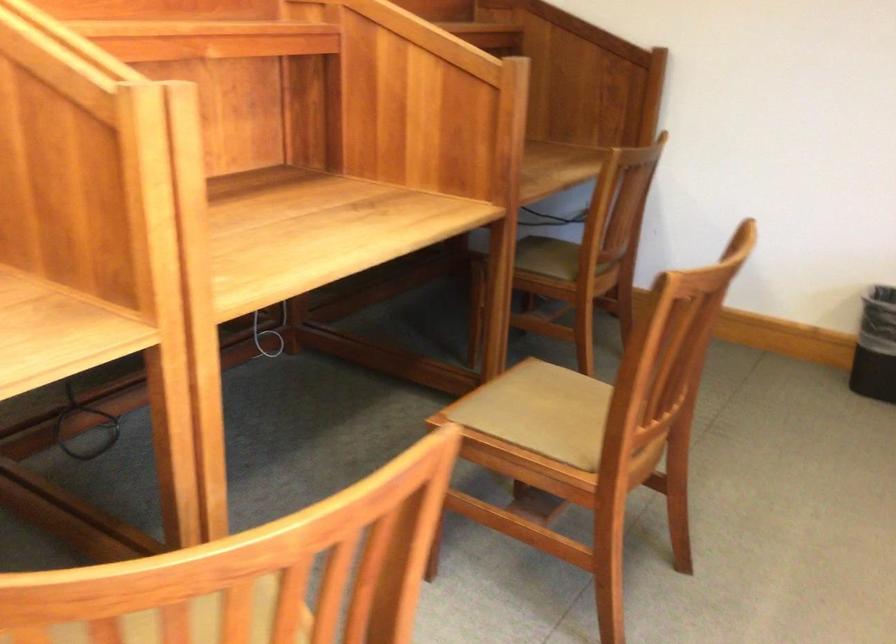
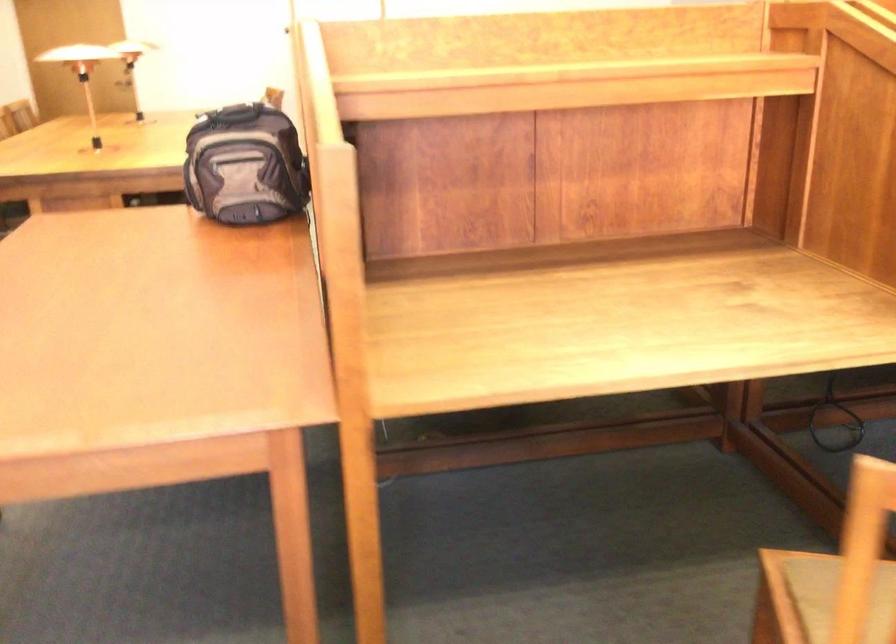
Question: The first image is from the beginning of the video and the second image is from the end. How did the camera likely rotate when shooting the video?

Choices:
 (A) Left
 (B) Right
 (C) Up
 (D) Down

Answer: (A)